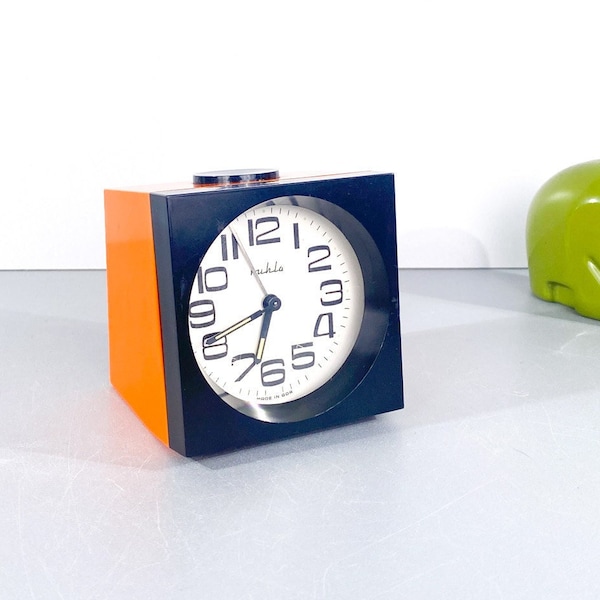
Locate an element on the screen. orange part of clock is located at coordinates (134, 323).